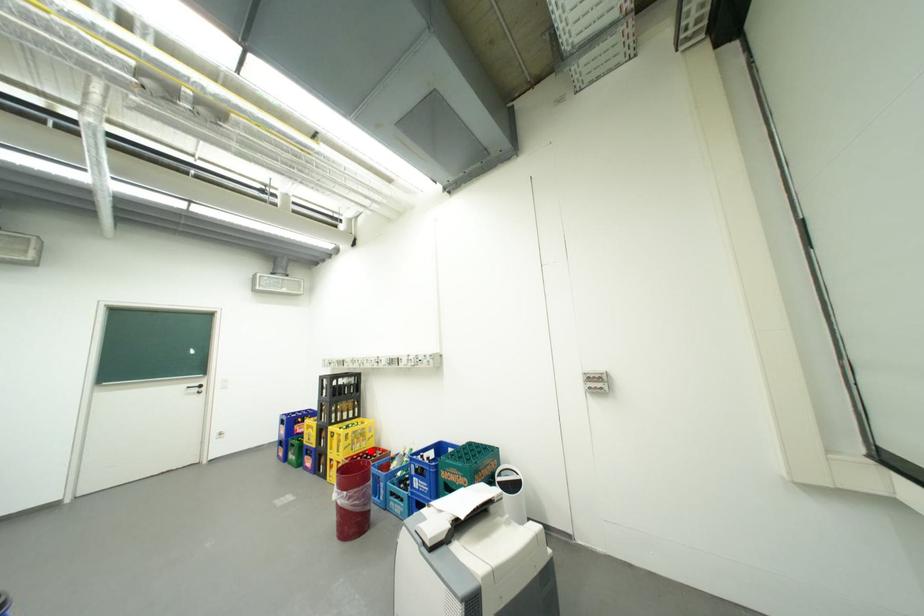
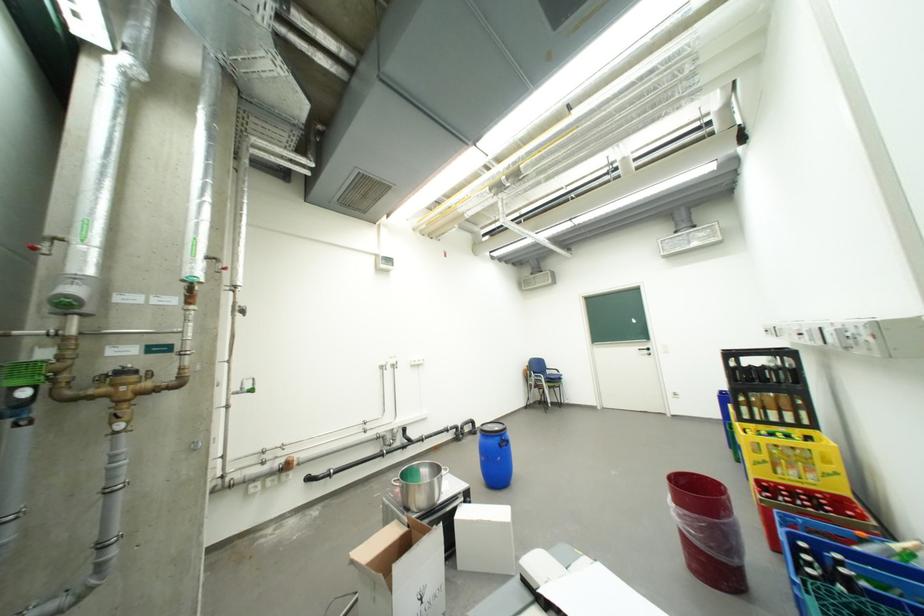
Question: I am providing you with two images of the same scene from different viewpoints. A red point is shown in image1. For the corresponding object point in image2, is it positioned nearer or farther from the camera?

Choices:
 (A) Nearer
 (B) Farther

Answer: (A)